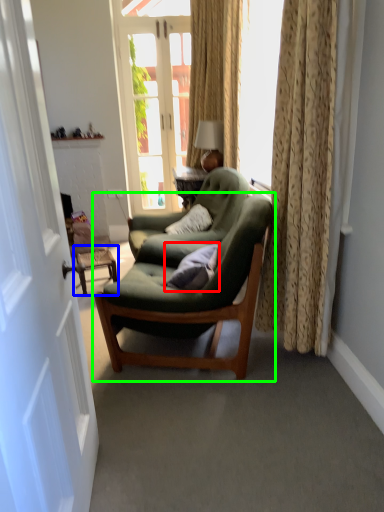
Question: Estimate the real-world distances between objects in this image. Which object is closer to pillow (highlighted by a red box), side table (highlighted by a blue box) or chair (highlighted by a green box)?

Choices:
 (A) side table
 (B) chair

Answer: (B)